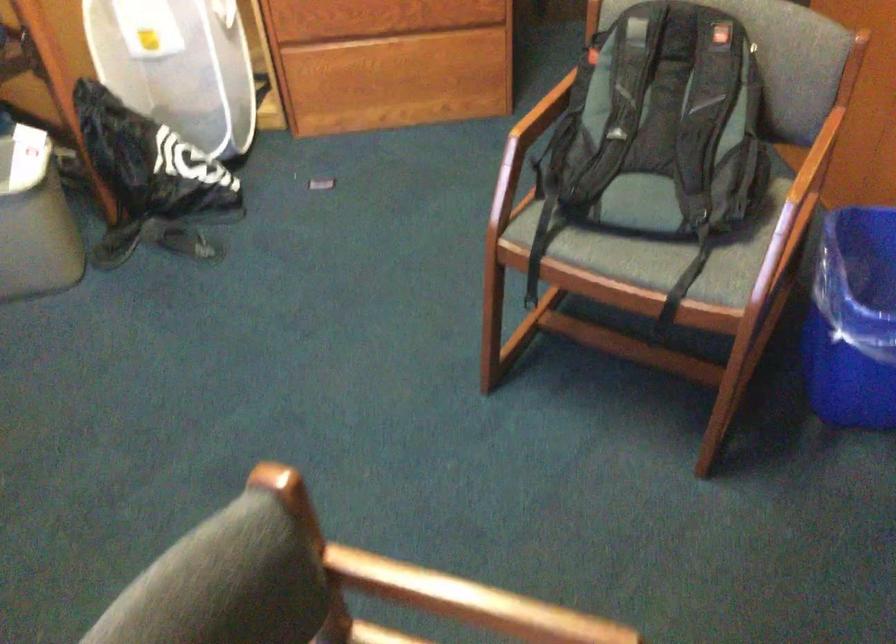
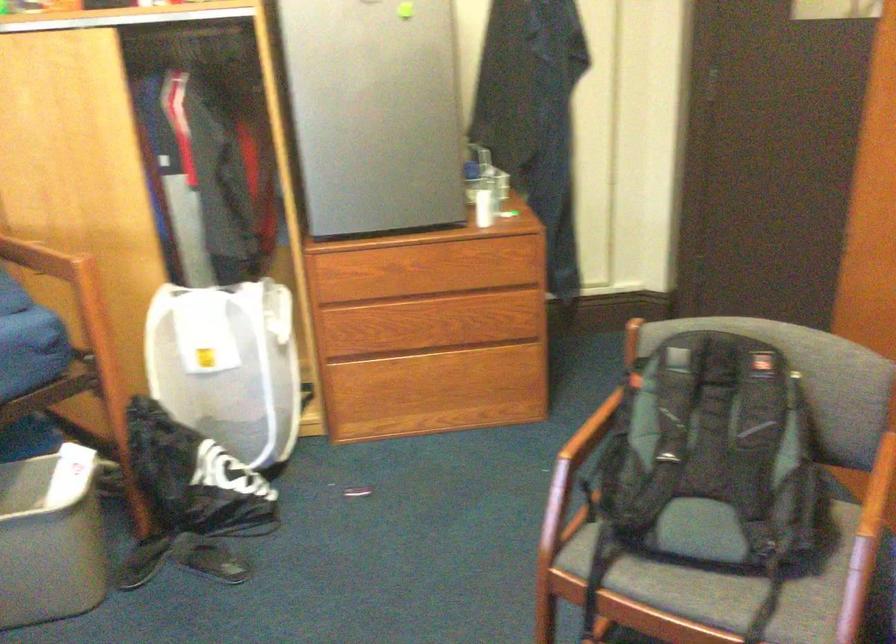
Where in the second image is the point corresponding to (x=664, y=131) from the first image?

(717, 456)